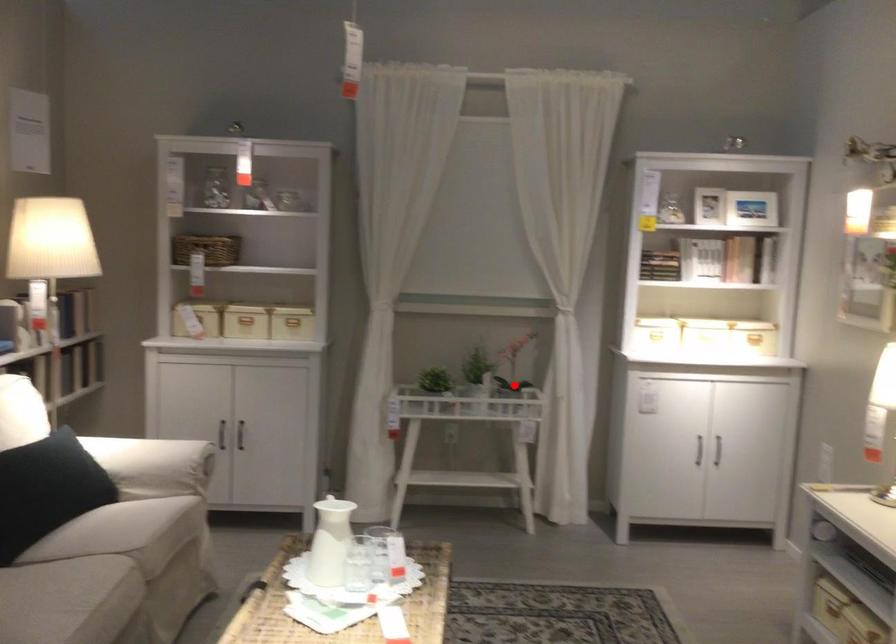
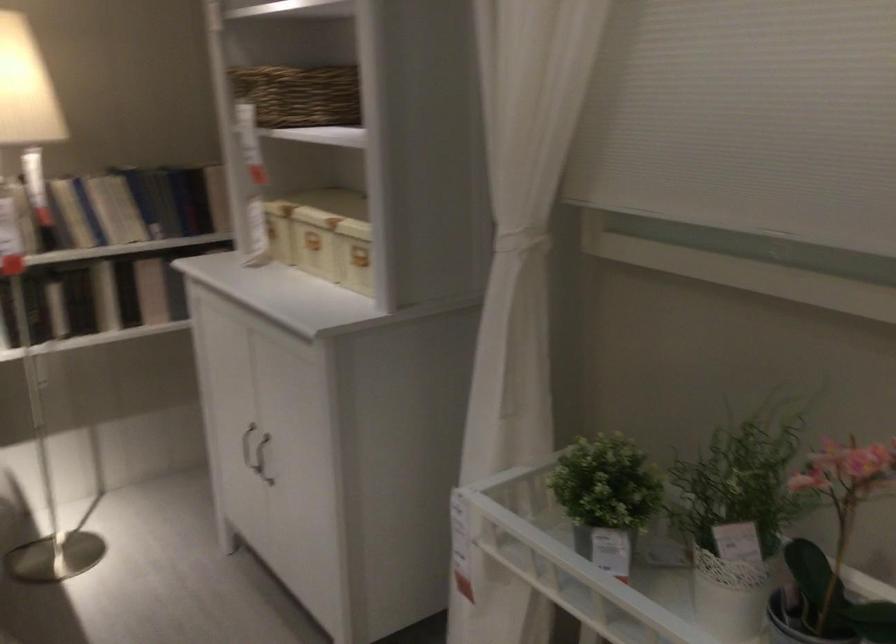
Question: I am providing you with two images of the same scene from different viewpoints. A red point is shown in image1. For the corresponding object point in image2, is it positioned nearer or farther from the camera?

Choices:
 (A) Nearer
 (B) Farther

Answer: (A)